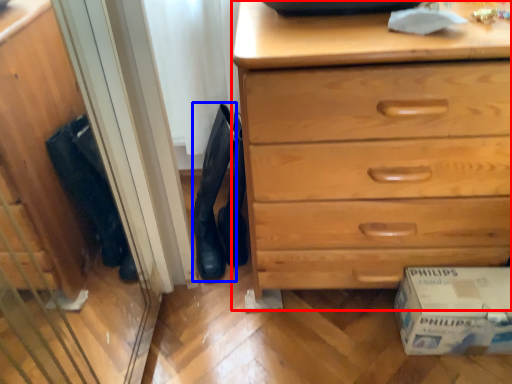
Question: Which point is closer to the camera, chest of drawers (highlighted by a red box) or boot (highlighted by a blue box)?

Choices:
 (A) chest of drawers
 (B) boot

Answer: (A)